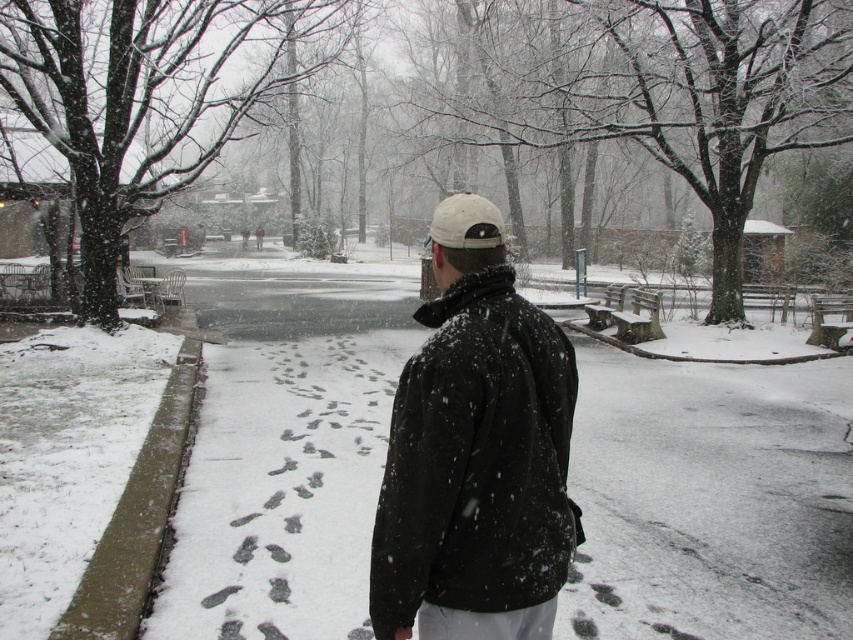
Question: Does black matte jacket at center appear on the left side of white matte baseball hat at center?

Choices:
 (A) yes
 (B) no

Answer: (A)

Question: Is black matte jacket at center positioned before white matte baseball hat at center?

Choices:
 (A) yes
 (B) no

Answer: (A)

Question: Can you confirm if black matte jacket at center is bigger than white matte baseball hat at center?

Choices:
 (A) no
 (B) yes

Answer: (B)

Question: Among these objects, which one is farthest from the camera?

Choices:
 (A) white matte baseball hat at center
 (B) black matte jacket at center

Answer: (A)